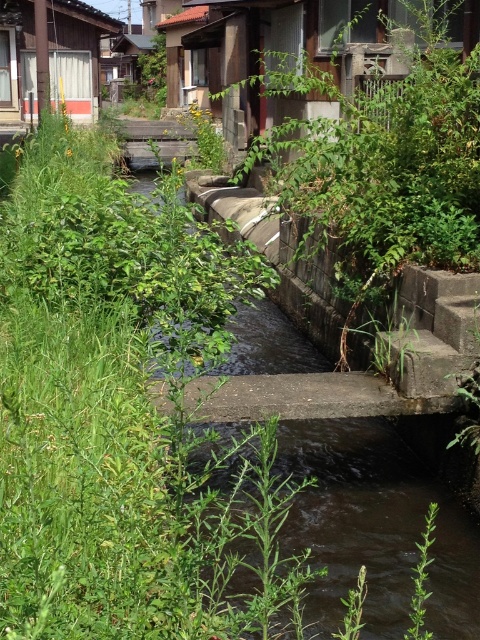
You are navigating a small boat along the narrow waterway shown in the scene. You notice two points marked on your map at coordinates point (x=340, y=454) and point (x=47, y=61). Which point is closer to your current position if you are approaching from the direction of the vegetation on the left side of the canal?

Point (x=47, y=61) is closer to your current position because it is behind point (x=340, y=454) along the waterway. Since you are approaching from the left vegetation side, the point further back would be nearer to your starting point.

You are standing at the camera position and want to reach the point at coordinates (347, 26). The path to this point is along the narrow waterway. If your boat can travel 15 meters before needing to refuel, will you need to refuel before reaching the point?

The distance between the point at (347, 26) and the camera is 12.05 meters. Since your boat can travel 15 meters before needing to refuel, you do not need to refuel before reaching the point at (347, 26).